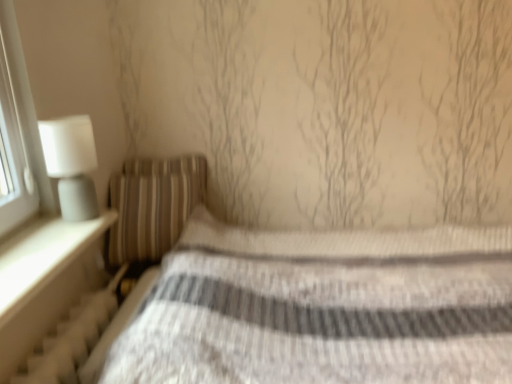
Where is `striped fabric bed at center`? striped fabric bed at center is located at coordinates (317, 308).

Locate an element on the screen. The width and height of the screenshot is (512, 384). white matte table lamp at left is located at coordinates 71,164.

Is white textured radiator at lower left completely or partially outside of striped fabric bed at center?

Yes, white textured radiator at lower left is outside of striped fabric bed at center.

Where is `radiator lying behind the striped fabric bed at center`? radiator lying behind the striped fabric bed at center is located at coordinates (71, 338).

Considering the sizes of objects white textured radiator at lower left and striped fabric bed at center in the image provided, who is shorter, white textured radiator at lower left or striped fabric bed at center?

white textured radiator at lower left.

Is point (70, 361) farther from camera compared to point (145, 329)?

Yes, point (70, 361) is behind point (145, 329).

Considering the points (130, 218) and (53, 173), which point is behind, point (130, 218) or point (53, 173)?

The point (130, 218) is farther.

Considering the sizes of striped fabric pillow at left and white matte table lamp at left in the image, is striped fabric pillow at left taller or shorter than white matte table lamp at left?

Clearly, striped fabric pillow at left is taller compared to white matte table lamp at left.

Which object is thinner, striped fabric pillow at left or white matte table lamp at left?

white matte table lamp at left is thinner.

From a real-world perspective, is striped fabric bed at center physically located above or below striped fabric pillow at left?

Clearly, from a real-world perspective, striped fabric bed at center is below striped fabric pillow at left.

Which object is positioned more to the right, striped fabric bed at center or striped fabric pillow at left?

From the viewer's perspective, striped fabric bed at center appears more on the right side.

Can you confirm if striped fabric pillow at left is wider than striped fabric bed at center?

Result: In fact, striped fabric pillow at left might be narrower than striped fabric bed at center.

From the image's perspective, which one is positioned lower, striped fabric pillow at left or striped fabric bed at center?

striped fabric bed at center, from the image's perspective.

Does striped fabric pillow at left turn towards striped fabric bed at center?

Yes, striped fabric pillow at left is turned towards striped fabric bed at center.

Between point (173, 216) and point (257, 369), which one is positioned behind?

The point (173, 216) is farther.

From the picture: From a real-world perspective, which object rests below the other?

striped fabric bed at center is physically lower.

Consider the image. Can you tell me how much striped fabric bed at center and white matte table lamp at left differ in facing direction?

The angle between the facing direction of striped fabric bed at center and the facing direction of white matte table lamp at left is 93.5 degrees.

Is striped fabric bed at center directly adjacent to white matte table lamp at left?

They are not placed beside each other.

Between striped fabric bed at center and white matte table lamp at left, which one has less height?

Standing shorter between the two is white matte table lamp at left.

Considering the relative sizes of white textured radiator at lower left and white matte table lamp at left in the image provided, is white textured radiator at lower left shorter than white matte table lamp at left?

Yes, white textured radiator at lower left is shorter than white matte table lamp at left.

Is white textured radiator at lower left spatially inside white matte table lamp at left, or outside of it?

white textured radiator at lower left is spatially situated outside white matte table lamp at left.

From a real-world perspective, is white textured radiator at lower left located higher than white matte table lamp at left?

No, from a real-world perspective, white textured radiator at lower left is not on top of white matte table lamp at left.

Can you tell me how much white textured radiator at lower left and white matte table lamp at left differ in facing direction?

2.47 degrees separate the facing orientations of white textured radiator at lower left and white matte table lamp at left.

Does white textured radiator at lower left have a smaller size compared to striped fabric pillow at left?

Yes.

What's the angular difference between white textured radiator at lower left and striped fabric pillow at left's facing directions?

80.1 degrees.

Does white textured radiator at lower left lie behind striped fabric pillow at left?

No, white textured radiator at lower left is closer to the camera.

In order to click on bed below the white textured radiator at lower left (from a real-world perspective) in this screenshot , I will do `click(317, 308)`.

In the image, there is a striped fabric pillow at left. Where is `table lamp above it (from the image's perspective)`? table lamp above it (from the image's perspective) is located at coordinates (71, 164).

When comparing their distances from striped fabric bed at center, does white textured radiator at lower left or striped fabric pillow at left seem further?

white textured radiator at lower left lies further to striped fabric bed at center than the other object.

Based on their spatial positions, is striped fabric bed at center or white matte table lamp at left further from white textured radiator at lower left?

The object further to white textured radiator at lower left is striped fabric bed at center.

When comparing their distances from striped fabric pillow at left, does striped fabric bed at center or white textured radiator at lower left seem closer?

Among the two, white textured radiator at lower left is located nearer to striped fabric pillow at left.

From the image, which object appears to be farther from striped fabric pillow at left, white textured radiator at lower left or white matte table lamp at left?

white matte table lamp at left.

Considering their positions, is white matte table lamp at left positioned closer to striped fabric pillow at left than white textured radiator at lower left?

white textured radiator at lower left is positioned closer to the anchor striped fabric pillow at left.

When comparing their distances from white textured radiator at lower left, does striped fabric pillow at left or striped fabric bed at center seem further?

striped fabric bed at center.

Looking at this image, when comparing their distances from white textured radiator at lower left, does white matte table lamp at left or striped fabric bed at center seem further?

Answer: striped fabric bed at center is positioned further to the anchor white textured radiator at lower left.

Considering their positions, is striped fabric bed at center positioned closer to white matte table lamp at left than white textured radiator at lower left?

white textured radiator at lower left is positioned closer to the anchor white matte table lamp at left.

Identify the location of pillow between white matte table lamp at left and white textured radiator at lower left in the vertical direction. The width and height of the screenshot is (512, 384). (152, 205).

Locate an element on the screen. The height and width of the screenshot is (384, 512). pillow located between white matte table lamp at left and striped fabric bed at center in the left-right direction is located at coordinates (152, 205).

This screenshot has width=512, height=384. I want to click on pillow between white textured radiator at lower left and striped fabric bed at center in the horizontal direction, so click(x=152, y=205).

Find the location of a particular element. Image resolution: width=512 pixels, height=384 pixels. radiator between white matte table lamp at left and striped fabric bed at center from left to right is located at coordinates (71, 338).